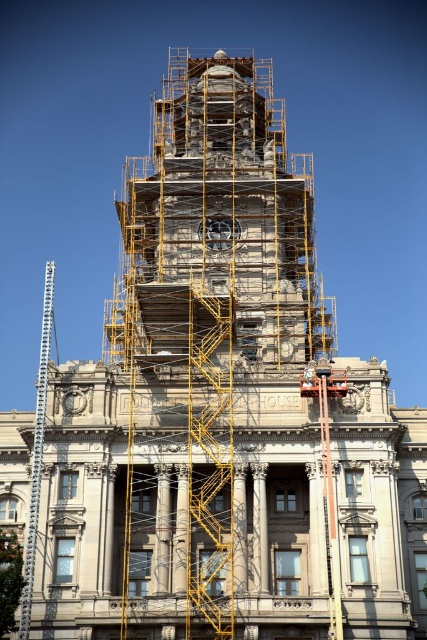
Is stone scaffolding at center to the left of white hard hat at center from the viewer's perspective?

Yes, stone scaffolding at center is to the left of white hard hat at center.

Does stone scaffolding at center have a greater height compared to white hard hat at center?

Correct, stone scaffolding at center is much taller as white hard hat at center.

The width and height of the screenshot is (427, 640). What do you see at coordinates (221, 214) in the screenshot?
I see `stone scaffolding at center` at bounding box center [221, 214].

The image size is (427, 640). I want to click on stone scaffolding at center, so click(221, 214).

From the picture: Can you confirm if yellow metal scaffolding at center is positioned to the left of white hard hat at center?

Indeed, yellow metal scaffolding at center is positioned on the left side of white hard hat at center.

Describe the element at coordinates (210, 464) in the screenshot. I see `yellow metal scaffolding at center` at that location.

You are a GUI agent. You are given a task and a screenshot of the screen. Output one action in this format:
    pyautogui.click(x=<x>, y=<y>)
    Task: Click on the yellow metal scaffolding at center
    The height and width of the screenshot is (640, 427).
    Given the screenshot: What is the action you would take?
    pyautogui.click(x=210, y=464)

Who is more distant from viewer, (309, 323) or (213, 560)?

Positioned behind is point (309, 323).

Which is more to the left, stone scaffolding at center or yellow metal scaffolding at center?

yellow metal scaffolding at center is more to the left.

Is point (310, 296) farther from camera compared to point (195, 419)?

Yes.

This screenshot has width=427, height=640. I want to click on stone scaffolding at center, so click(221, 214).